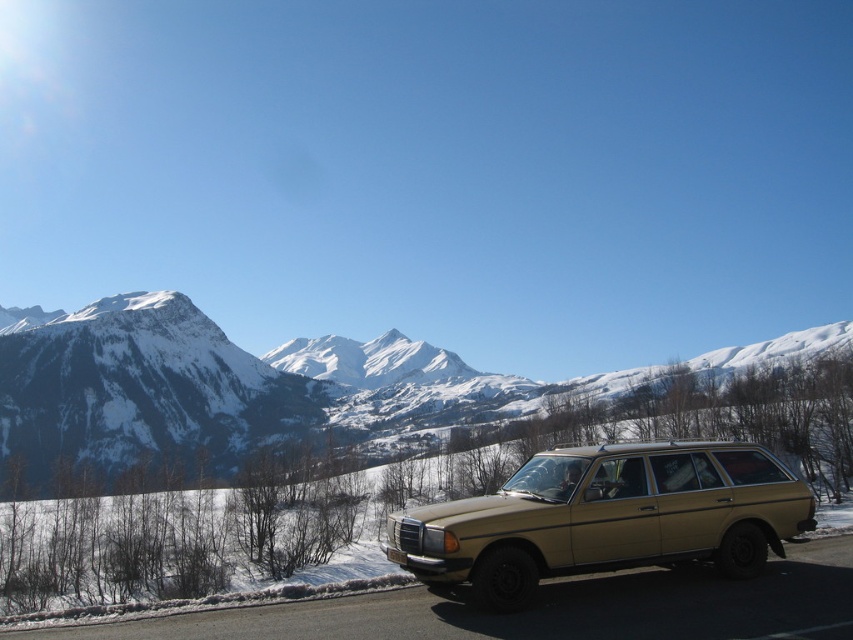
You are a photographer planning to capture the snowy white mountain range at upper left and the gold metallic station wagon at lower right in the same frame. Which object will appear taller in the photograph?

The snowy white mountain range at upper left will appear taller in the photograph since it has a greater height compared to the gold metallic station wagon at lower right according to the description.

You are a photographer wanting to capture both the snowy white mountain range at upper left and the gold metallic station wagon at lower right in the same frame. Which object should you focus on first to ensure both are in focus?

The snowy white mountain range at upper left is closer to the viewer than the gold metallic station wagon at lower right, so focusing on the snowy white mountain range at upper left first would help ensure both are in focus.